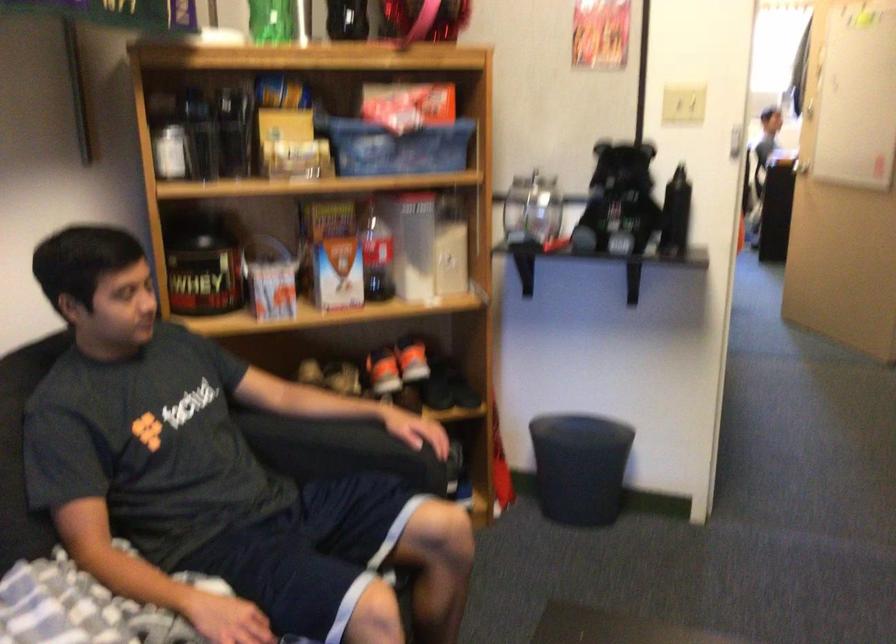
Where would you resting arm the black sofa armrest? Please return your answer as a coordinate pair (x, y).

(330, 444)